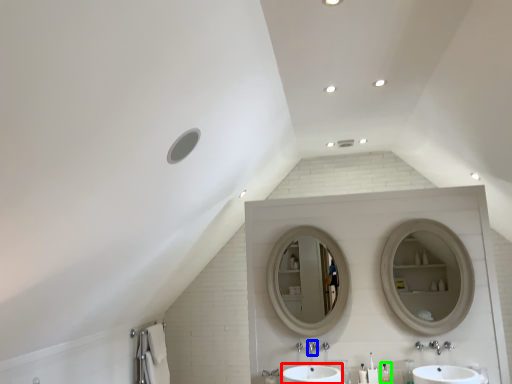
Question: Considering the real-world distances, which object is closest to sink (highlighted by a red box)? plumbing fixture (highlighted by a blue box) or toiletry (highlighted by a green box).

Choices:
 (A) plumbing fixture
 (B) toiletry

Answer: (A)